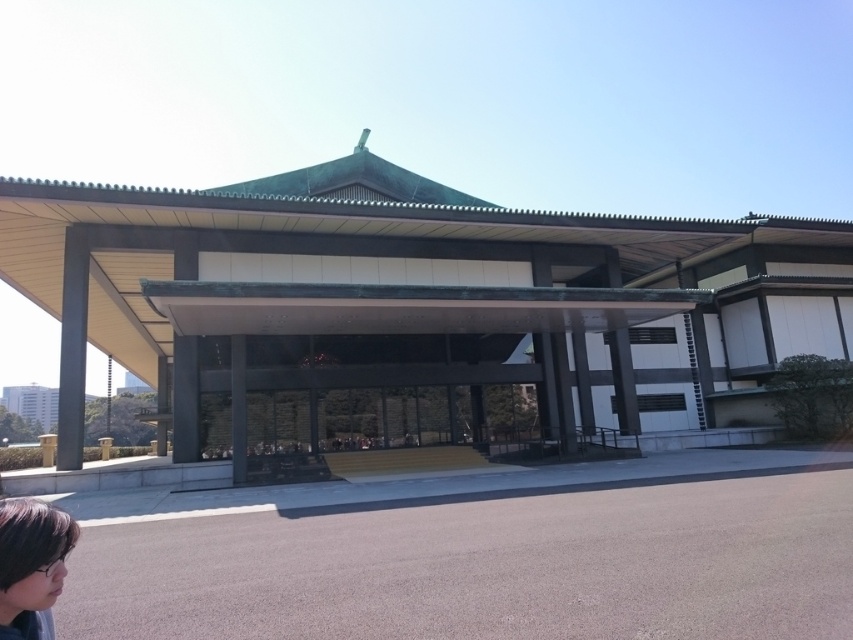
You are standing at the entrance of the traditional building and want to walk towards the point marked as point (25, 557). As you move forward, will the point marked as point (401, 365) become closer or farther away from you?

The point (401, 365) is further to the viewer than point (25, 557). So as you walk towards point (25, 557), the point (401, 365) will become farther away from you.

You are a visitor approaching the green matte building at center and dark brown hair at lower left. Which object is taller?

The green matte building at center is much taller than the dark brown hair at lower left.